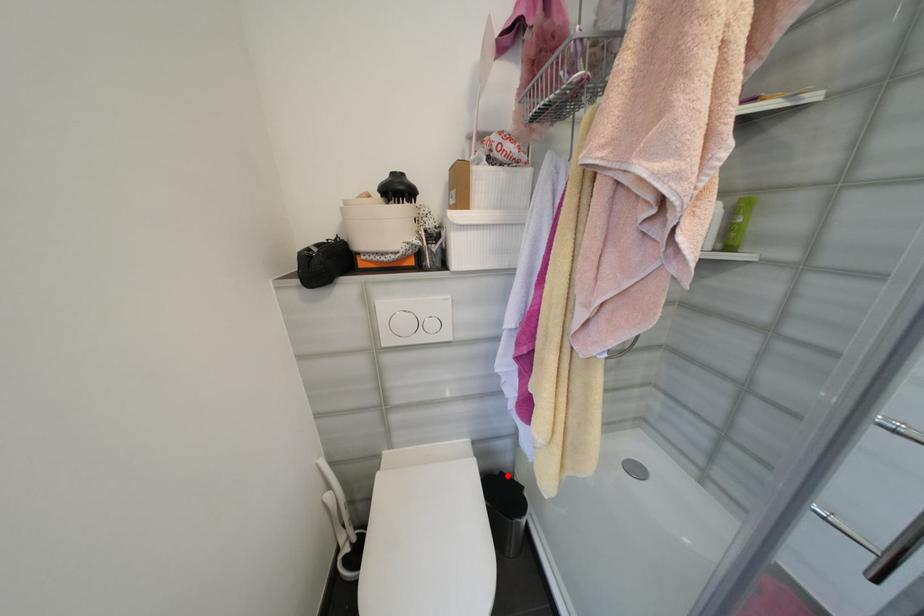
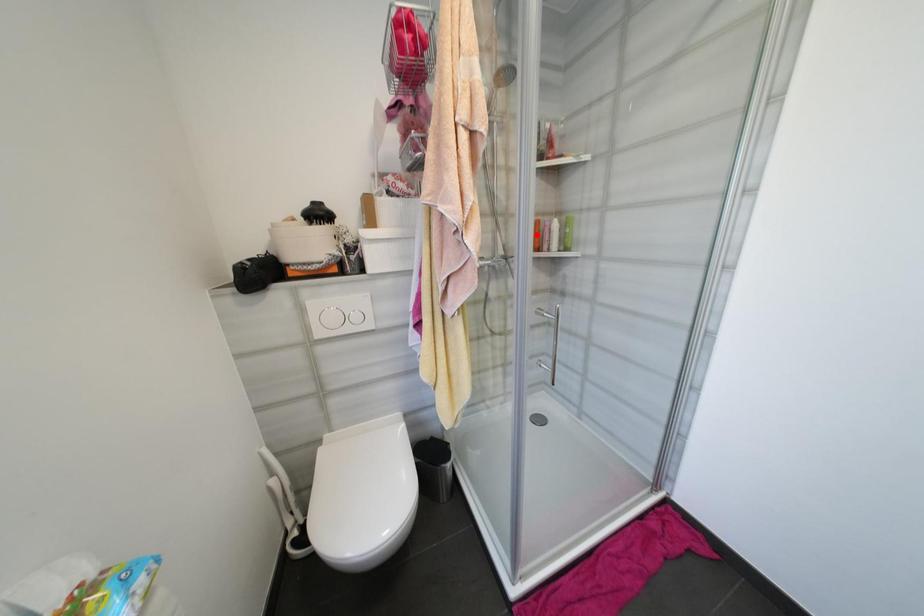
I am providing you with two images of the same scene from different viewpoints. A red point is marked on the first image and another point is marked on the second image. Is the red point in image1 aligned with the point shown in image2?

No